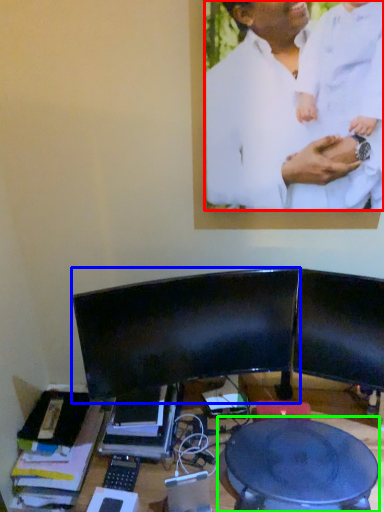
Question: Estimate the real-world distances between objects in this image. Which object is closer to man (highlighted by a red box), computer monitor (highlighted by a blue box) or round table (highlighted by a green box)?

Choices:
 (A) computer monitor
 (B) round table

Answer: (A)